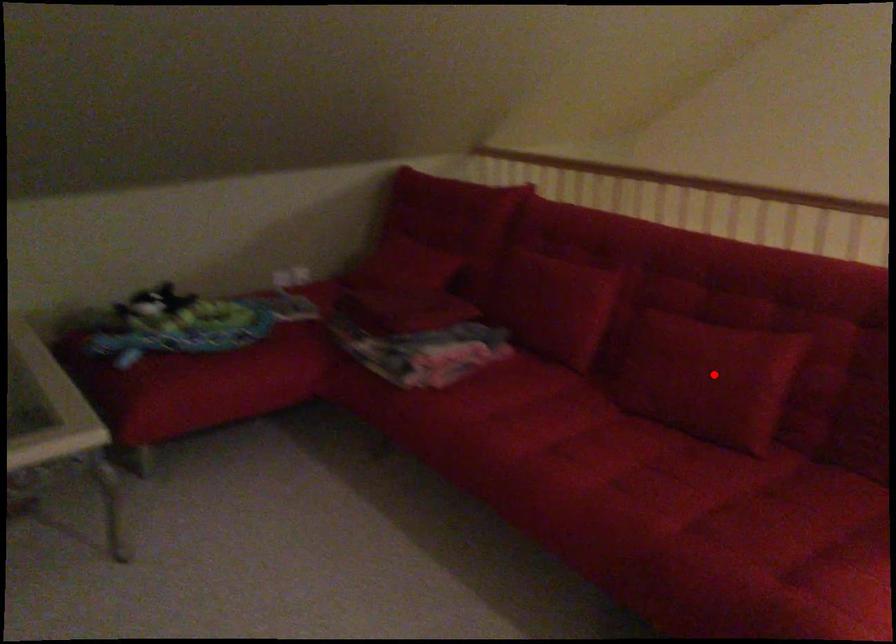
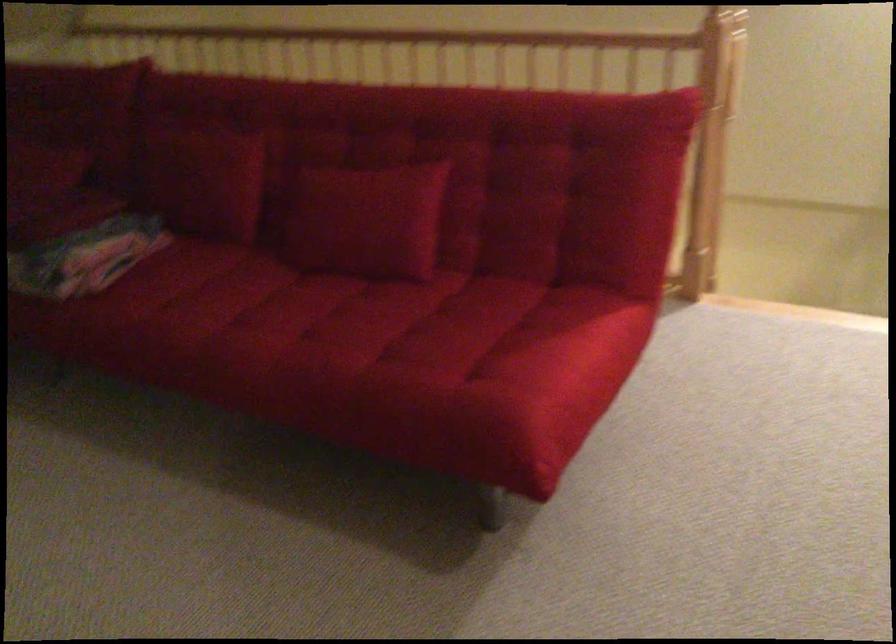
Find the pixel in the second image that matches the highlighted location in the first image.

(366, 220)